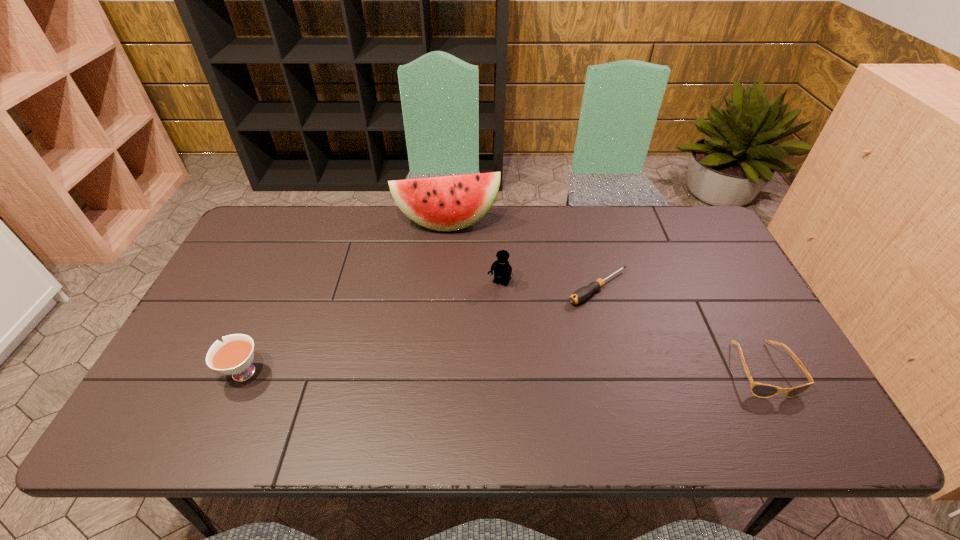
Where is `vacant space that's between the leftmost object and the second shortest object`? vacant space that's between the leftmost object and the second shortest object is located at coordinates (501, 371).

The height and width of the screenshot is (540, 960). I want to click on the second closest object to the shortest object, so click(x=761, y=390).

Select which object appears as the third closest to the fourth shortest object. Please provide its 2D coordinates. Your answer should be formatted as a tuple, i.e. [(x, y)], where the tuple contains the x and y coordinates of a point satisfying the conditions above.

[(761, 390)]

What are the coordinates of `vacant space that satisfies the following two spatial constraints: 1. on the front side of the farthest object; 2. on the left side of the screwdriver` in the screenshot? It's located at (441, 288).